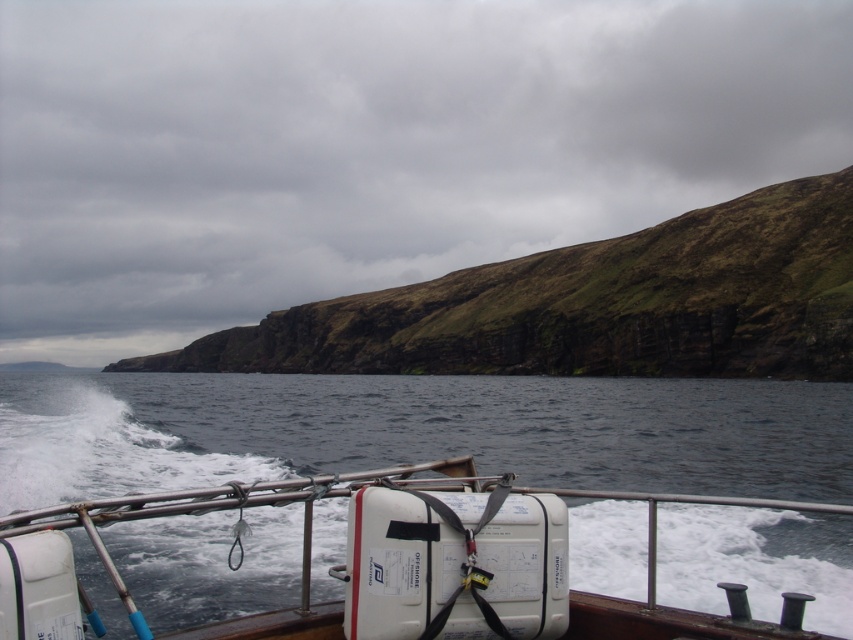
Question: Is green grassy cliff at upper center to the left of white plastic container at center from the viewer's perspective?

Choices:
 (A) yes
 (B) no

Answer: (A)

Question: Which object appears closest to the camera in this image?

Choices:
 (A) white plastic container at center
 (B) green grassy cliff at upper center

Answer: (A)

Question: Which point is closer to the camera?

Choices:
 (A) green grassy cliff at upper center
 (B) white plastic container at center

Answer: (B)

Question: Is green grassy cliff at upper center in front of white plastic container at center?

Choices:
 (A) yes
 (B) no

Answer: (B)

Question: Can you confirm if green grassy cliff at upper center is positioned to the right of white plastic container at center?

Choices:
 (A) no
 (B) yes

Answer: (A)

Question: Which of the following is the farthest from the observer?

Choices:
 (A) green grassy cliff at upper center
 (B) white plastic container at center

Answer: (A)